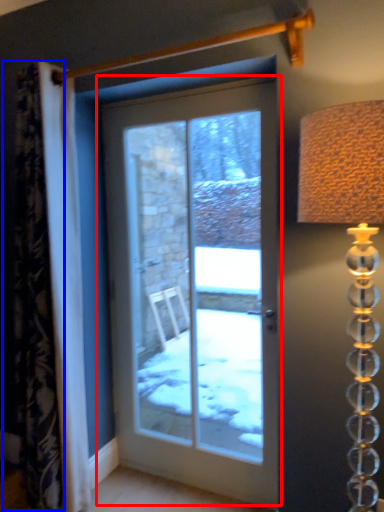
Question: Which point is closer to the camera, door (highlighted by a red box) or curtain (highlighted by a blue box)?

Choices:
 (A) door
 (B) curtain

Answer: (B)